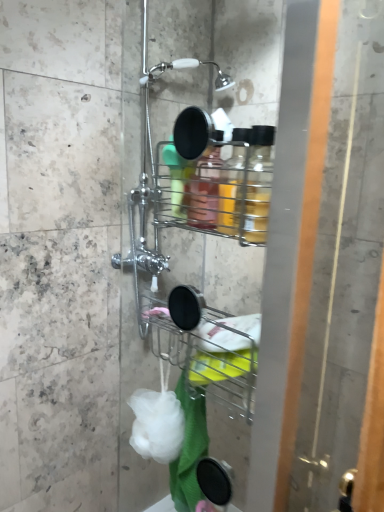
Question: Is white soft bath towel at lower center spatially inside transparent glass screen door at right, or outside of it?

Choices:
 (A) outside
 (B) inside

Answer: (A)

Question: Is white soft bath towel at lower center taller or shorter than transparent glass screen door at right?

Choices:
 (A) tall
 (B) short

Answer: (B)

Question: Estimate the real-world distances between objects in this image. Which object is farther from the transparent glass screen door at right?

Choices:
 (A) white soft bath towel at lower center
 (B) white matte sponge at lower center

Answer: (B)

Question: Which is farther from the transparent glass screen door at right?

Choices:
 (A) white matte sponge at lower center
 (B) white soft bath towel at lower center

Answer: (A)